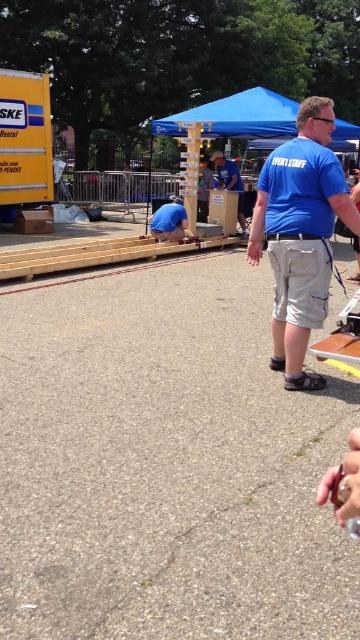
What do you see at coordinates (96, 259) in the screenshot? I see `wooden at center` at bounding box center [96, 259].

Can you confirm if wooden at center is positioned above matte blue shirt at center?

No, wooden at center is not above matte blue shirt at center.

Between point (132, 268) and point (228, 173), which one is positioned behind?

The point (228, 173) is behind.

Find the location of a particular element. The width and height of the screenshot is (360, 640). wooden at center is located at coordinates (96, 259).

Does wooden at center have a greater width compared to blue fabric at center?

Yes.

Does wooden at center appear on the right side of blue fabric at center?

In fact, wooden at center is to the left of blue fabric at center.

Is point (100, 248) positioned before point (180, 211)?

That is True.

Locate an element on the screen. The image size is (360, 640). wooden at center is located at coordinates (96, 259).

Can you confirm if blue fabric at center is wider than matte blue shirt at center?

In fact, blue fabric at center might be narrower than matte blue shirt at center.

Does blue fabric at center have a smaller size compared to matte blue shirt at center?

Indeed, blue fabric at center has a smaller size compared to matte blue shirt at center.

Which is in front, point (156, 227) or point (234, 172)?

Point (156, 227) is in front.

Locate an element on the screen. This screenshot has height=640, width=360. blue fabric at center is located at coordinates pos(168,221).